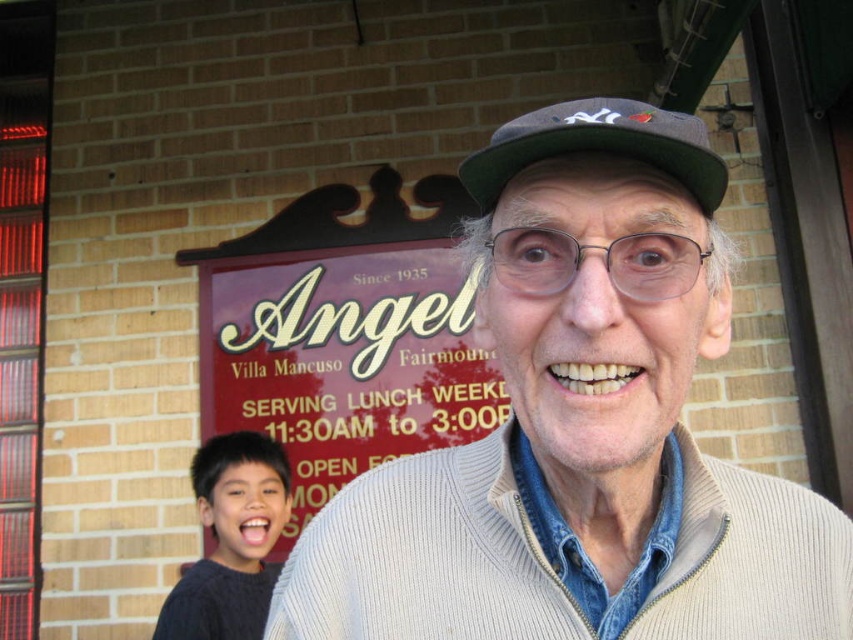
You are trying to decide which item to pack first for a trip. You have both the white knit sweater at center and the green fabric baseball cap at center. If you want to pack the larger item first, which one should you pack?

The white knit sweater at center is bigger than the green fabric baseball cap at center, so you should pack the white knit sweater at center first.